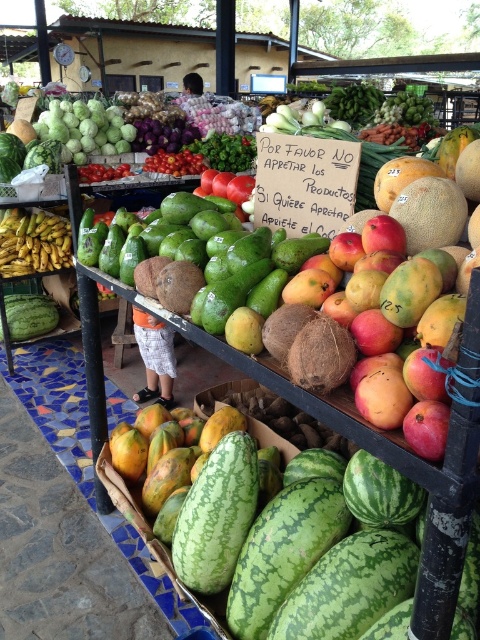
Question: Which of the following is the closest to the observer?

Choices:
 (A) (48, 252)
 (B) (14, 321)
 (C) (236, 483)
 (D) (385, 314)

Answer: (D)

Question: Estimate the real-world distances between objects in this image. Which object is closer to the green matte watermelon at lower left?

Choices:
 (A) green textured watermelon at center
 (B) smooth yellow cantaloupe at center
 (C) yellow bananas at left
 (D) ripe mangoes at center

Answer: (C)

Question: Does green textured watermelon at center appear under smooth yellow cantaloupe at center?

Choices:
 (A) no
 (B) yes

Answer: (B)

Question: Is green textured watermelon at center above green matte watermelon at lower left?

Choices:
 (A) no
 (B) yes

Answer: (A)

Question: Does ripe mangoes at center have a larger size compared to green matte watermelon at lower left?

Choices:
 (A) no
 (B) yes

Answer: (B)

Question: Which of the following is the farthest from the observer?

Choices:
 (A) (360, 310)
 (B) (430, 189)
 (C) (472, 609)
 (D) (69, 248)

Answer: (D)